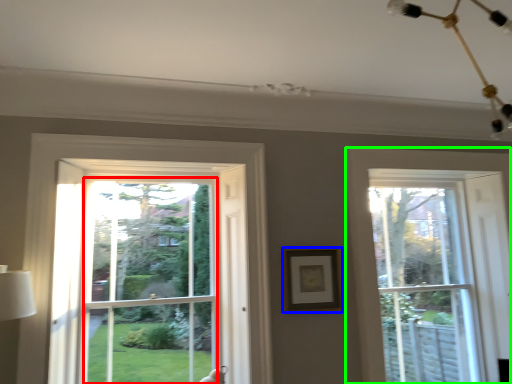
Question: Which is nearer to the window screen (highlighted by a red box)? picture frame (highlighted by a blue box) or window (highlighted by a green box).

Choices:
 (A) picture frame
 (B) window

Answer: (A)